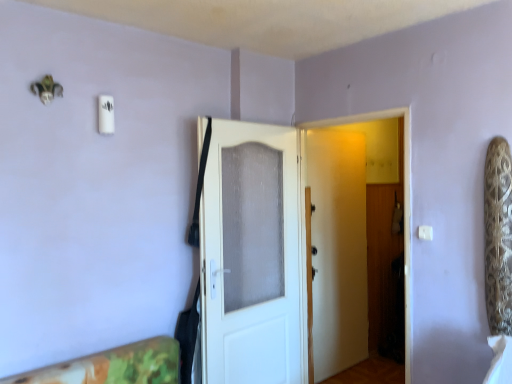
Question: Is the position of white matte door at center, the 1th door when ordered from right to left, more distant than that of white textured door at center, arranged as the first door when viewed from the left?

Choices:
 (A) yes
 (B) no

Answer: (B)

Question: Considering the relative sizes of white matte door at center, which appears as the second door when viewed from the left, and white textured door at center, which ranks as the second door in right-to-left order, in the image provided, is white matte door at center, which appears as the second door when viewed from the left, thinner than white textured door at center, which ranks as the second door in right-to-left order,?

Choices:
 (A) no
 (B) yes

Answer: (A)

Question: Is white matte door at center, the 1th door when ordered from right to left, at the right side of white textured door at center, arranged as the first door when viewed from the left?

Choices:
 (A) no
 (B) yes

Answer: (B)

Question: Considering the relative sizes of white matte door at center, which appears as the second door when viewed from the left, and white textured door at center, which ranks as the second door in right-to-left order, in the image provided, is white matte door at center, which appears as the second door when viewed from the left, smaller than white textured door at center, which ranks as the second door in right-to-left order,?

Choices:
 (A) yes
 (B) no

Answer: (B)

Question: From the image's perspective, is white matte door at center, which appears as the second door when viewed from the left, over white textured door at center, which ranks as the second door in right-to-left order?

Choices:
 (A) yes
 (B) no

Answer: (A)

Question: Considering the positions of point (x=301, y=238) and point (x=428, y=228), is point (x=301, y=238) closer or farther from the camera than point (x=428, y=228)?

Choices:
 (A) farther
 (B) closer

Answer: (A)

Question: In the image, is white matte door at center, the 1th door when ordered from right to left, on the left side or the right side of white plastic light switch at upper right?

Choices:
 (A) left
 (B) right

Answer: (A)

Question: Relative to white plastic light switch at upper right, is white matte door at center, the 1th door when ordered from right to left, in front or behind?

Choices:
 (A) front
 (B) behind

Answer: (B)

Question: From a real-world perspective, is white matte door at center, which appears as the second door when viewed from the left, above or below white plastic light switch at upper right?

Choices:
 (A) above
 (B) below

Answer: (B)

Question: Relative to white matte door at center, the 1th door when ordered from right to left, is white plastic light switch at upper right in front or behind?

Choices:
 (A) behind
 (B) front

Answer: (B)

Question: From a real-world perspective, is white plastic light switch at upper right physically located above or below white matte door at center, which appears as the second door when viewed from the left?

Choices:
 (A) above
 (B) below

Answer: (A)

Question: In terms of size, does white plastic light switch at upper right appear bigger or smaller than white matte door at center, the 1th door when ordered from right to left?

Choices:
 (A) big
 (B) small

Answer: (B)

Question: Is white plastic light switch at upper right inside or outside of white matte door at center, the 1th door when ordered from right to left?

Choices:
 (A) outside
 (B) inside

Answer: (A)

Question: Visually, is white textured door at center, which ranks as the second door in right-to-left order, positioned to the left or to the right of white matte door at center, which appears as the second door when viewed from the left?

Choices:
 (A) right
 (B) left

Answer: (B)

Question: Considering the positions of point (274, 276) and point (406, 208), is point (274, 276) closer or farther from the camera than point (406, 208)?

Choices:
 (A) farther
 (B) closer

Answer: (A)